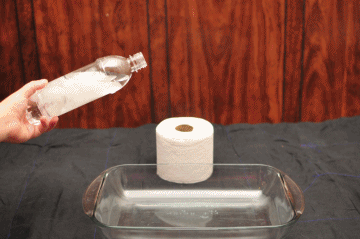
Locate an element on the screen. This screenshot has height=239, width=360. sheet is located at coordinates (324, 133).